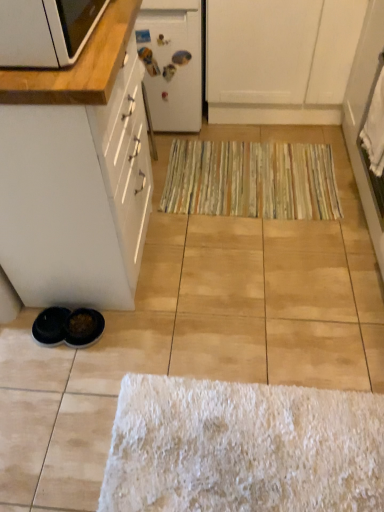
Question: From the image's perspective, is matte wood countertop at upper left above or below white matte cabinet at lower left, the 1th cabinetry when ordered from left to right?

Choices:
 (A) below
 (B) above

Answer: (B)

Question: Is matte wood countertop at upper left inside the boundaries of white matte cabinet at lower left, the 1th cabinetry when ordered from left to right, or outside?

Choices:
 (A) inside
 (B) outside

Answer: (B)

Question: Considering the real-world distances, which object is farthest from the matte wood countertop at upper left?

Choices:
 (A) striped fabric doormat at center
 (B) white matte cabinet at upper center, acting as the 2th cabinetry starting from the bottom
 (C) white matte refrigerator at upper center
 (D) white matte cabinet at lower left, the 1th cabinetry when ordered from front to back

Answer: (B)

Question: Based on their relative distances, which object is nearer to the striped fabric doormat at center?

Choices:
 (A) white matte cabinet at lower left, the second cabinetry from the back
 (B) white matte refrigerator at upper center
 (C) white matte cabinet at upper center, the first cabinetry when ordered from right to left
 (D) matte wood countertop at upper left

Answer: (C)